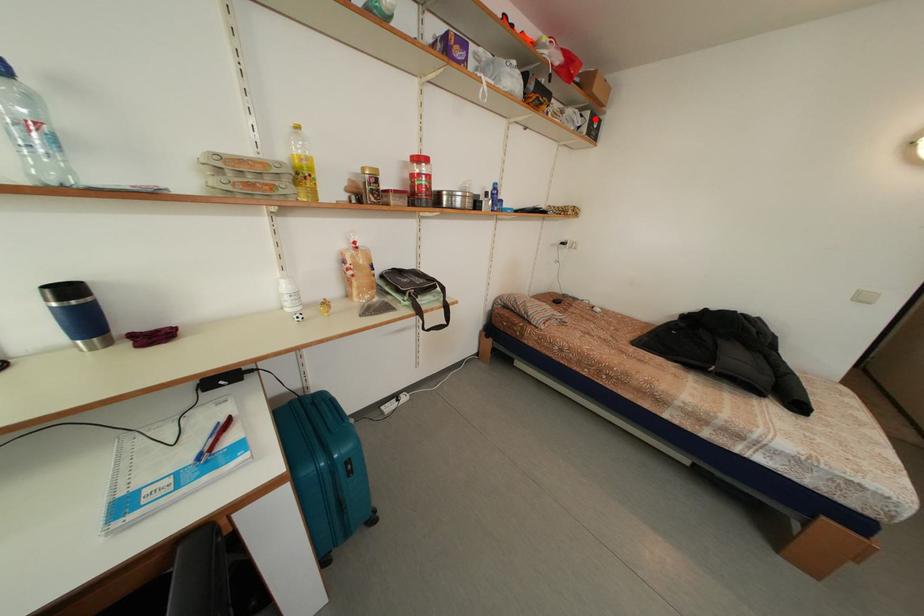
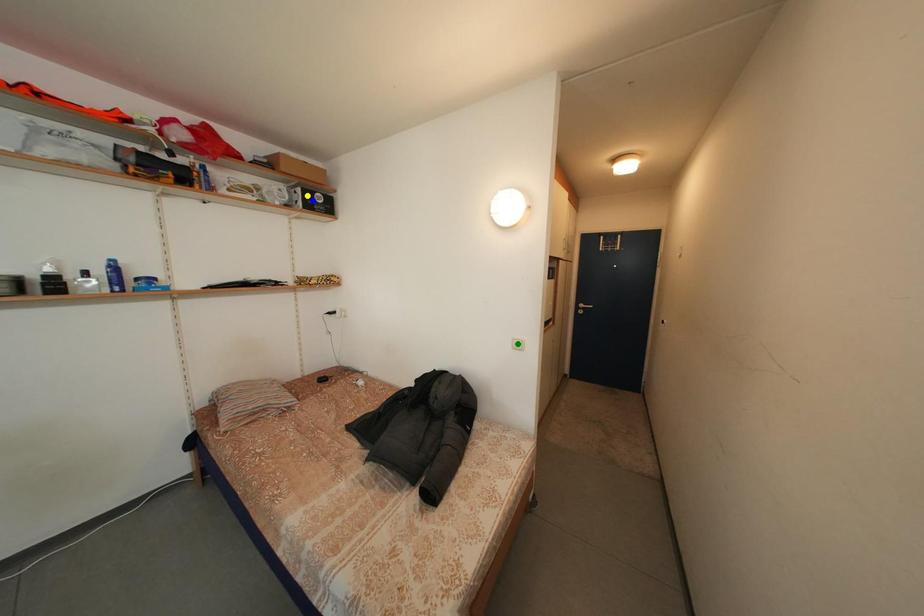
Question: I am providing you with two images of the same scene from different viewpoints. A red point is marked on the first image. You are given multiple points on the second image. Can you choose the point in image 2 that corresponds to the point in image 1?

Choices:
 (A) yellow point
 (B) green point
 (C) blue point

Answer: (A)